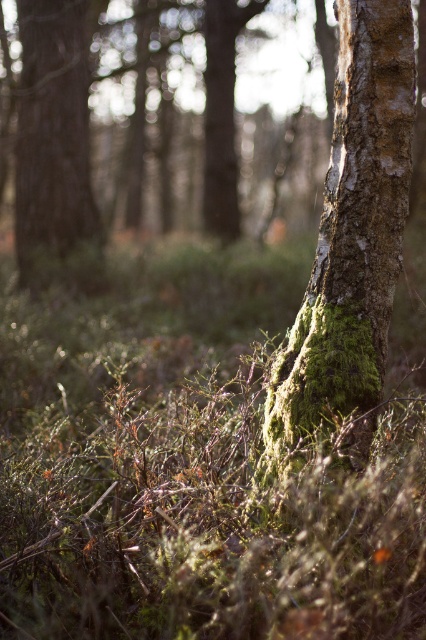
Question: Which object is positioned farthest from the green mossy grass at center?

Choices:
 (A) brown rough tree trunk at left
 (B) green mossy bark at center

Answer: (A)

Question: Which point is closer to the camera?

Choices:
 (A) green mossy grass at center
 (B) green mossy bark at center

Answer: (A)

Question: Where is green mossy grass at center located in relation to brown rough tree trunk at left in the image?

Choices:
 (A) left
 (B) right

Answer: (B)

Question: Is green mossy bark at center above brown rough tree trunk at left?

Choices:
 (A) yes
 (B) no

Answer: (B)

Question: Does green mossy grass at center have a greater width compared to brown rough tree trunk at left?

Choices:
 (A) yes
 (B) no

Answer: (B)

Question: Which point is closer to the camera?

Choices:
 (A) (339, 106)
 (B) (127, 378)
 (C) (45, 276)

Answer: (A)